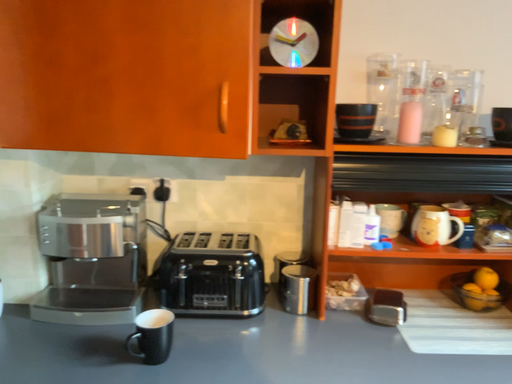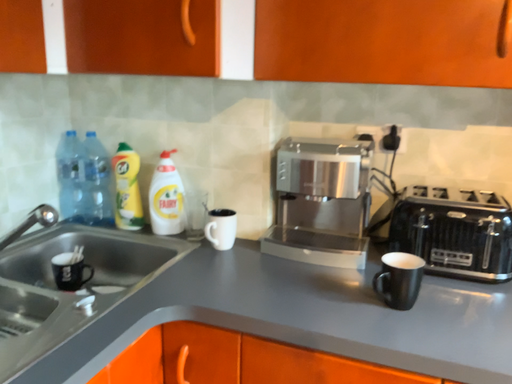
Question: Which way did the camera rotate in the video?

Choices:
 (A) rotated left
 (B) rotated right

Answer: (A)